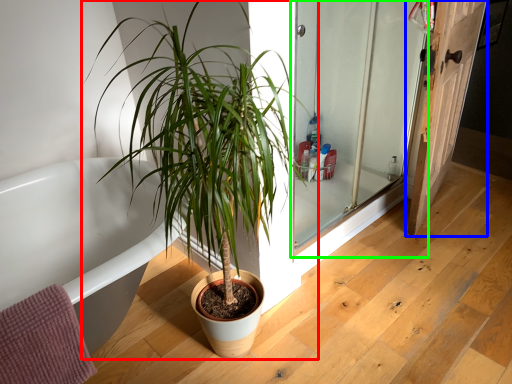
Question: Which object is positioned closest to houseplant (highlighted by a red box)? Select from door (highlighted by a blue box) and screen door (highlighted by a green box).

Choices:
 (A) door
 (B) screen door

Answer: (B)